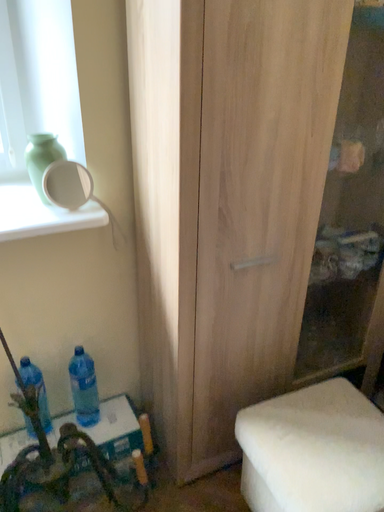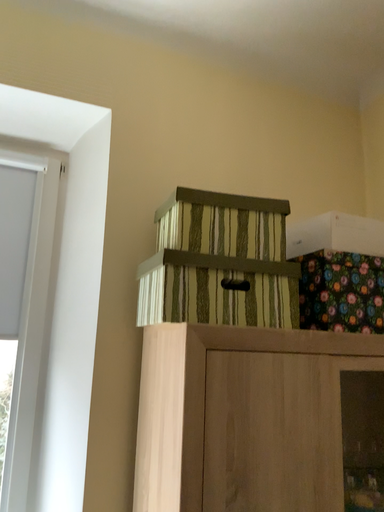
Question: How did the camera likely rotate when shooting the video?

Choices:
 (A) rotated downward
 (B) rotated upward

Answer: (B)